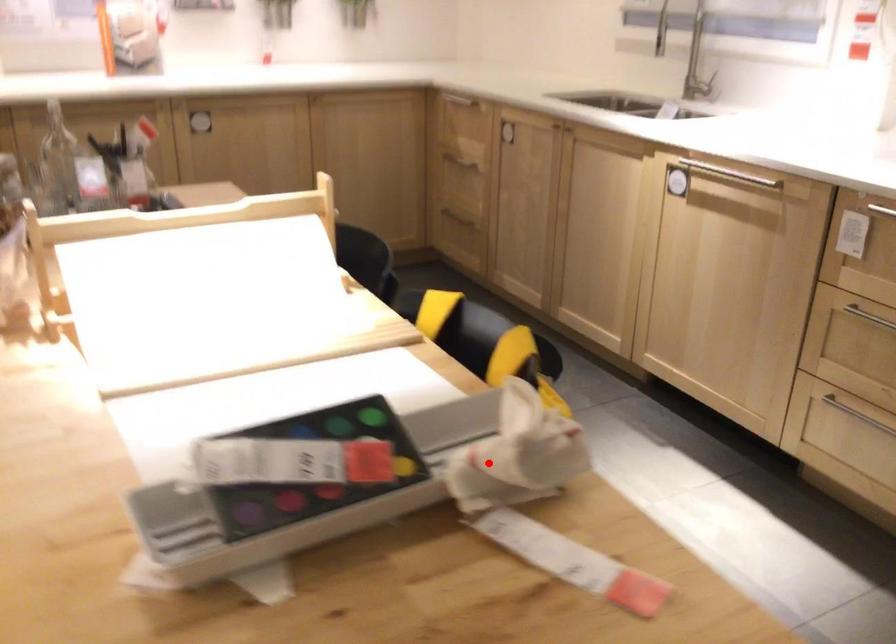
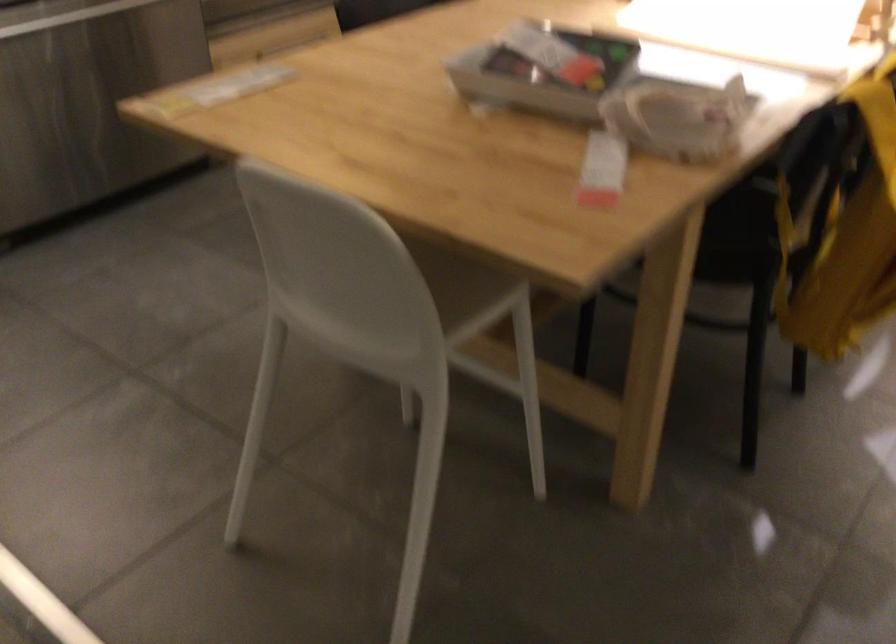
Find the pixel in the second image that matches the highlighted location in the first image.

(677, 117)